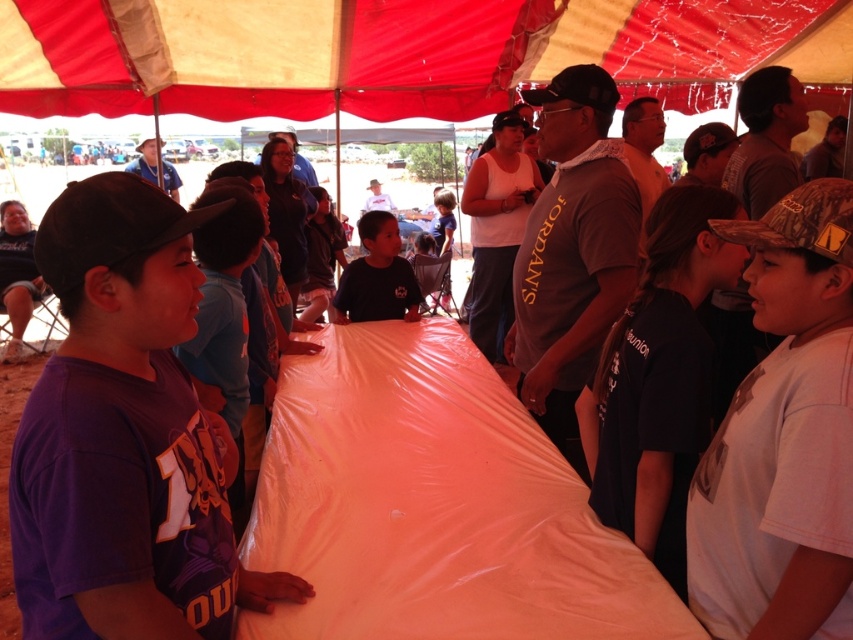
Question: Can you confirm if red fabric canopy at upper center is wider than dark blue shirt at center?

Choices:
 (A) yes
 (B) no

Answer: (A)

Question: Which point is closer to the camera taking this photo?

Choices:
 (A) (672, 104)
 (B) (383, 282)

Answer: (B)

Question: Is red fabric canopy at upper center bigger than dark blue shirt at center?

Choices:
 (A) no
 (B) yes

Answer: (A)

Question: Can you confirm if red fabric canopy at upper center is smaller than dark blue shirt at center?

Choices:
 (A) no
 (B) yes

Answer: (B)

Question: Which object appears farthest from the camera in this image?

Choices:
 (A) red fabric canopy at upper center
 (B) dark blue shirt at center

Answer: (A)